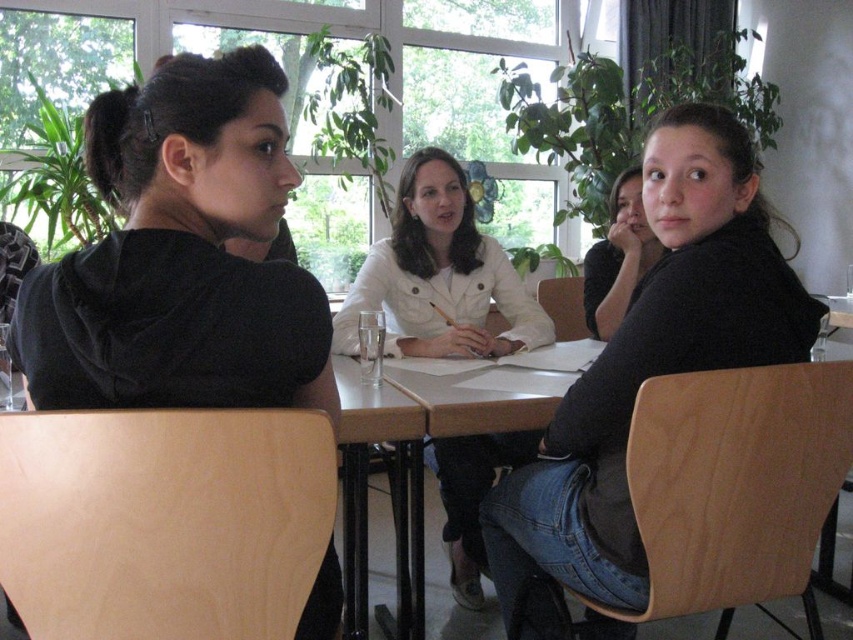
Question: Does black matte jacket at upper right lie behind white matte jacket at center?

Choices:
 (A) yes
 (B) no

Answer: (B)

Question: Is the position of white matte jacket at center less distant than that of black plastic table at center?

Choices:
 (A) yes
 (B) no

Answer: (B)

Question: Which point appears farthest from the camera in this image?

Choices:
 (A) (413, 547)
 (B) (619, 380)

Answer: (A)

Question: Does black plastic table at center appear on the right side of black matte shirt at upper right?

Choices:
 (A) yes
 (B) no

Answer: (B)

Question: Among these objects, which one is farthest from the camera?

Choices:
 (A) white matte jacket at center
 (B) black matte shirt at upper right
 (C) black matte jacket at upper right
 (D) black plastic table at center

Answer: (B)

Question: Among these objects, which one is farthest from the camera?

Choices:
 (A) black matte shirt at upper right
 (B) black plastic table at center
 (C) black velvet shirt at left

Answer: (A)